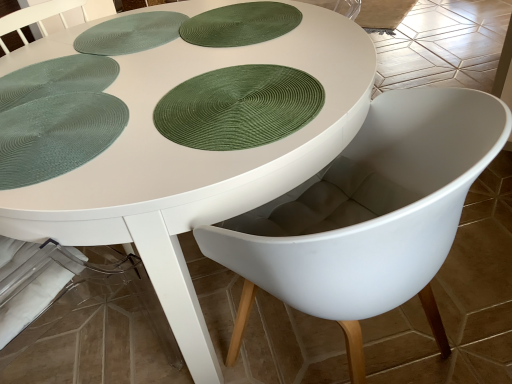
Locate an element on the screen. vacant area on top of green textured placemat at upper center, the 1th paper plate viewed from the top (from a real-world perspective) is located at coordinates (238, 26).